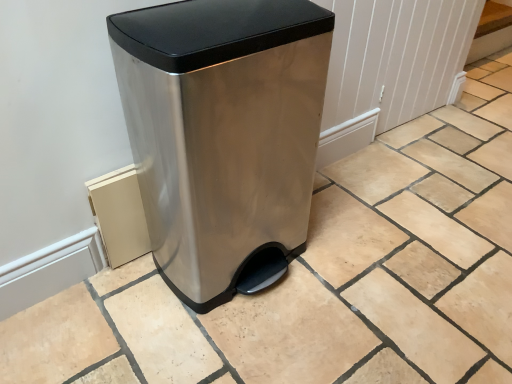
The height and width of the screenshot is (384, 512). Describe the element at coordinates (223, 135) in the screenshot. I see `stainless steel trash can at center` at that location.

In order to click on stainless steel trash can at center in this screenshot , I will do `click(223, 135)`.

Identify the location of stainless steel trash can at center. The image size is (512, 384). (223, 135).